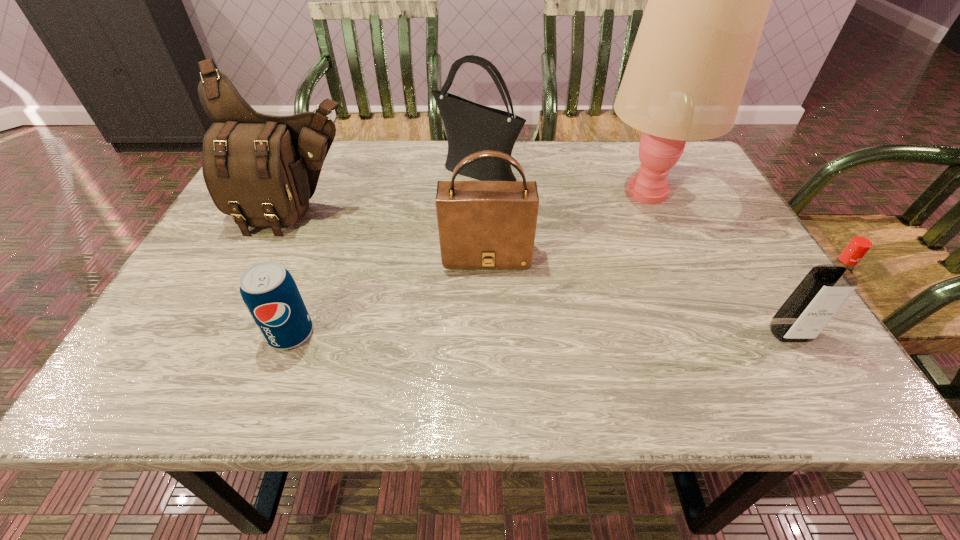
Identify the location of vacant area at the left edge of the desktop. The width and height of the screenshot is (960, 540). (160, 344).

In the image, there is a desktop. Where is `free region at the right edge`? This screenshot has height=540, width=960. free region at the right edge is located at coordinates (739, 353).

Image resolution: width=960 pixels, height=540 pixels. I want to click on vacant area between the vodka and the shortest shoulder bag, so click(637, 294).

At what (x,y) coordinates should I click in order to perform the action: click on unoccupied position between the tallest object and the vodka. Please return your answer as a coordinate pair (x, y). Looking at the image, I should click on (718, 262).

Where is `free space between the nearest shoulder bag and the vodka`? The image size is (960, 540). free space between the nearest shoulder bag and the vodka is located at coordinates (637, 294).

Where is `vacant space that is in between the farthest shoulder bag and the second nearest shoulder bag`? The image size is (960, 540). vacant space that is in between the farthest shoulder bag and the second nearest shoulder bag is located at coordinates coord(387,192).

You are a GUI agent. You are given a task and a screenshot of the screen. Output one action in this format:
    pyautogui.click(x=<x>, y=<y>)
    Task: Click on the empty location between the pop and the second farthest shoulder bag
    This screenshot has width=960, height=540.
    Given the screenshot: What is the action you would take?
    pyautogui.click(x=294, y=273)

I want to click on free spot between the tallest object and the nearest shoulder bag, so click(x=566, y=223).

Where is `empty location between the fourth farthest object and the second nearest shoulder bag`? empty location between the fourth farthest object and the second nearest shoulder bag is located at coordinates (392, 234).

Locate an element on the screen. This screenshot has height=540, width=960. the third closest object to the shortest shoulder bag is located at coordinates (260, 169).